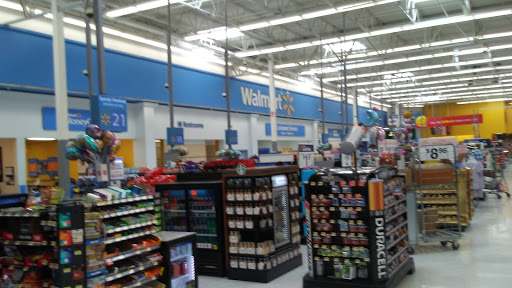
You are a GUI agent. You are given a task and a screenshot of the screen. Output one action in this format:
    pyautogui.click(x=<x>, y=<y>)
    Task: Click on the vertical dark gray support bars
    
    Given the screenshot: What is the action you would take?
    pyautogui.click(x=88, y=77), pyautogui.click(x=99, y=73), pyautogui.click(x=170, y=95), pyautogui.click(x=227, y=101), pyautogui.click(x=321, y=118), pyautogui.click(x=343, y=116), pyautogui.click(x=348, y=117), pyautogui.click(x=368, y=103), pyautogui.click(x=380, y=115), pyautogui.click(x=391, y=120)